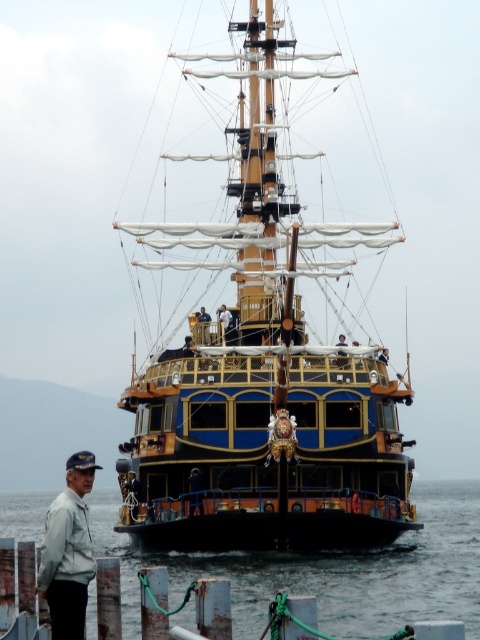
You are standing on a pier and see the wooden polished ship at center and the white matte jacket at lower left in the distance. Which object is closer to you?

The wooden polished ship at center is closer to you because it is further to the viewer than the white matte jacket at lower left.

You are an observer on the shore looking at the wooden polished ship at center and the transparent water at lower center. Which object is closer to you?

The wooden polished ship at center is closer to you because the transparent water at lower center is behind it.

You are standing on the deck of the ship and looking towards the point at coordinates point [264,390]. What object is located at that point?

The point [264,390] corresponds to the wooden polished ship at center.